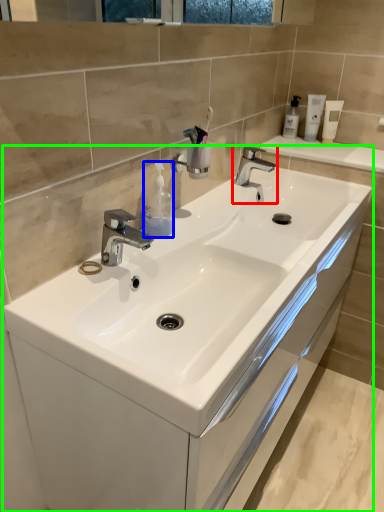
Question: Which is farther away from tap (highlighted by a red box)? soap dispenser (highlighted by a blue box) or bathroom cabinet (highlighted by a green box)?

Choices:
 (A) soap dispenser
 (B) bathroom cabinet

Answer: (B)